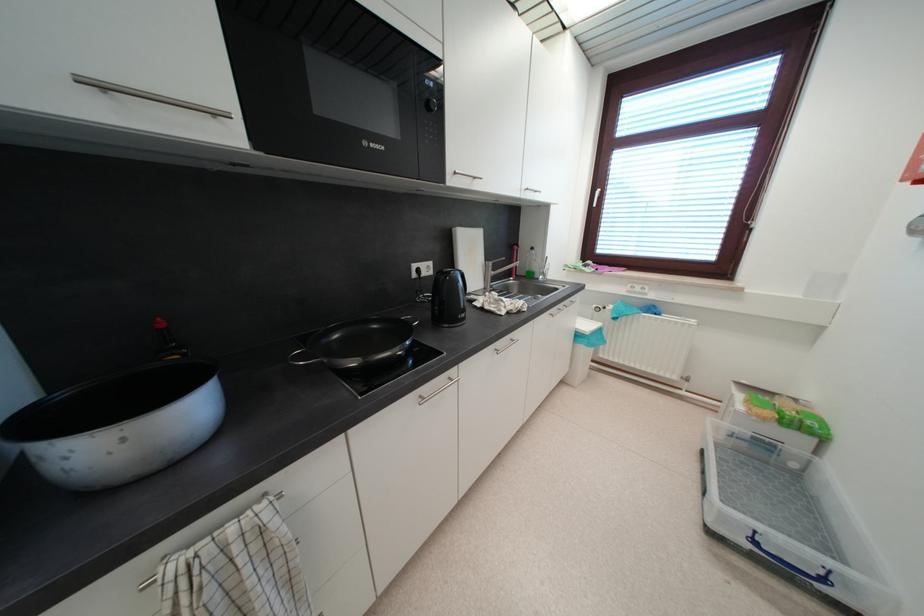
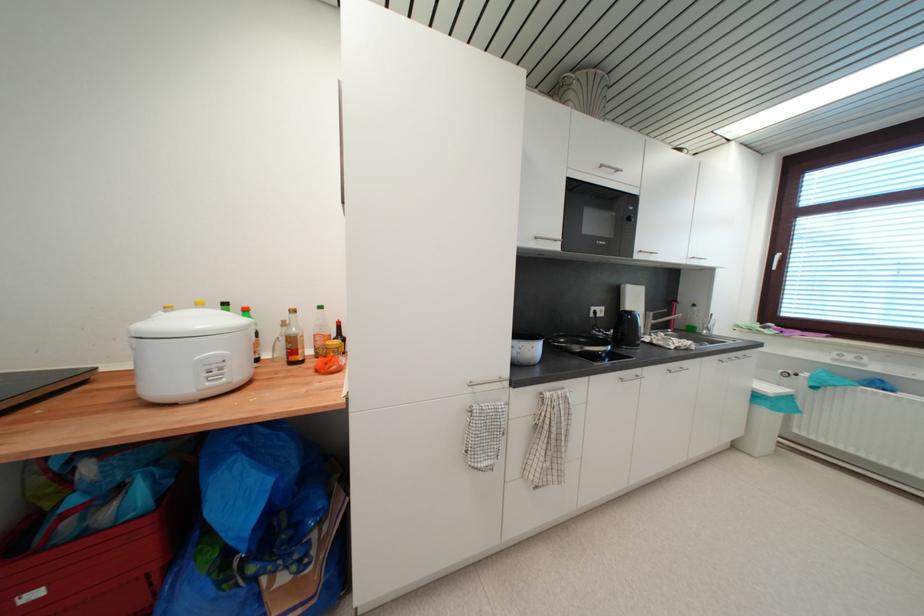
Where in the second image is the point corresponding to [427,400] from the first image?

(626, 381)